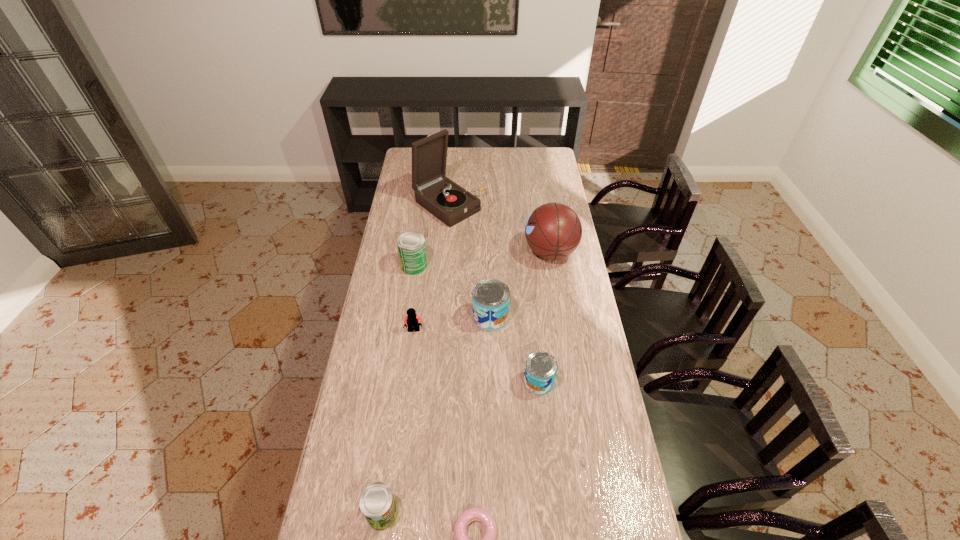
The width and height of the screenshot is (960, 540). I want to click on the nearest can, so click(x=377, y=503).

Image resolution: width=960 pixels, height=540 pixels. I want to click on the smaller green can, so click(377, 503).

Where is `vacant position located on the back of the farthest object`? This screenshot has width=960, height=540. vacant position located on the back of the farthest object is located at coordinates (453, 154).

Identify the location of free space located 0.330m on the left of the basketball. (448, 252).

Find the location of a particular element. The image size is (960, 540). vacant space positioned 0.340m on the back of the farther green can is located at coordinates (422, 209).

The height and width of the screenshot is (540, 960). I want to click on vacant area located on the left of the bigger blue can, so click(x=428, y=317).

This screenshot has height=540, width=960. I want to click on vacant area located on the front-facing side of the Lego, so click(412, 351).

Image resolution: width=960 pixels, height=540 pixels. I want to click on blank space located on the left of the rightmost can, so click(x=444, y=382).

Where is `free spot located 0.090m on the left of the smaller green can`? Image resolution: width=960 pixels, height=540 pixels. free spot located 0.090m on the left of the smaller green can is located at coordinates (335, 513).

Image resolution: width=960 pixels, height=540 pixels. Identify the location of phonograph record located in the left edge section of the desktop. (450, 203).